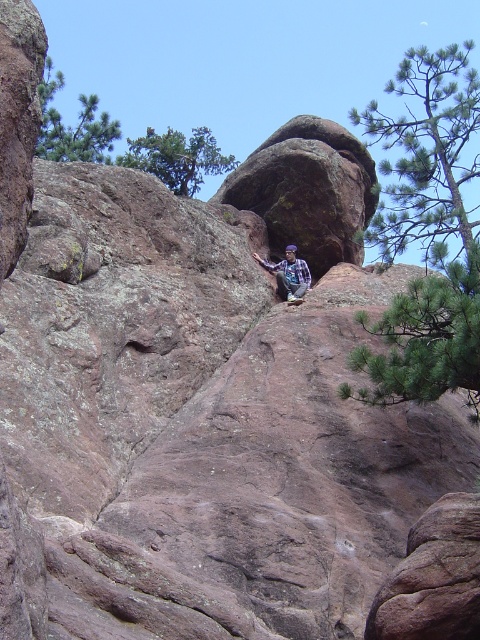
Based on the photo, which is more to the right, green needle-like leaves at upper right or green leafy tree at upper left?

From the viewer's perspective, green needle-like leaves at upper right appears more on the right side.

Does green needle-like leaves at upper right have a larger size compared to green leafy tree at upper left?

Indeed, green needle-like leaves at upper right has a larger size compared to green leafy tree at upper left.

Is point (433, 288) farther from camera compared to point (154, 161)?

That is False.

Identify the location of green needle-like leaves at upper right. (428, 230).

Which of these two, green leafy tree at upper left or green textured pine tree at upper left, stands taller?

With more height is green textured pine tree at upper left.

Is point (166, 168) closer to viewer compared to point (43, 99)?

Yes, point (166, 168) is closer to viewer.

Does point (152, 131) come farther from viewer compared to point (95, 108)?

Yes, it is behind point (95, 108).

Identify the location of green leafy tree at upper left. Image resolution: width=480 pixels, height=640 pixels. (178, 157).

Is green needle-like leaves at upper right positioned behind green pine branch at upper right?

Yes, green needle-like leaves at upper right is behind green pine branch at upper right.

Does point (433, 368) come in front of point (458, 269)?

Yes, point (433, 368) is closer to viewer.

This screenshot has height=640, width=480. What do you see at coordinates (428, 230) in the screenshot?
I see `green needle-like leaves at upper right` at bounding box center [428, 230].

You are a GUI agent. You are given a task and a screenshot of the screen. Output one action in this format:
    pyautogui.click(x=<x>, y=<y>)
    Task: Click on the green needle-like leaves at upper right
    
    Given the screenshot: What is the action you would take?
    pyautogui.click(x=428, y=230)